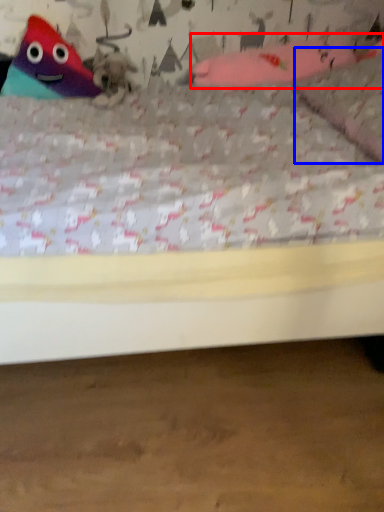
Question: Which of the following is the farthest to the observer, toy (highlighted by a red box) or pillow (highlighted by a blue box)?

Choices:
 (A) toy
 (B) pillow

Answer: (A)